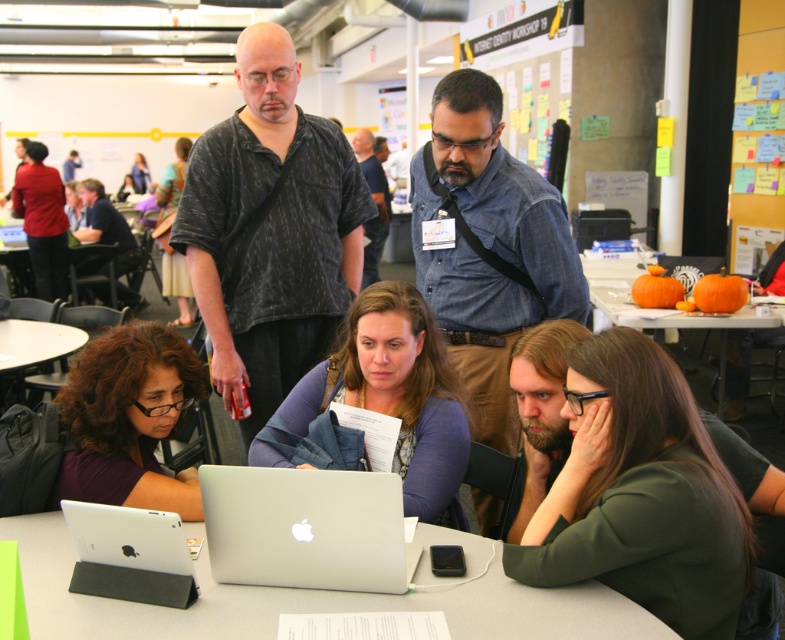
Question: Can you confirm if black textured shirt at upper center is positioned above white paperboard at upper center?

Choices:
 (A) no
 (B) yes

Answer: (A)

Question: Does silver metallic laptop at center have a smaller size compared to white paperboard at upper center?

Choices:
 (A) yes
 (B) no

Answer: (A)

Question: Which point is closer to the camera taking this photo?

Choices:
 (A) (473, 337)
 (B) (740, 218)

Answer: (A)

Question: Estimate the real-world distances between objects in this image. Which object is closer to the white paperboard at upper center?

Choices:
 (A) black textured shirt at upper center
 (B) white plastic table at lower center
 (C) white plastic table at lower left
 (D) white matte tablet at lower left

Answer: (A)

Question: Which point is farther from the camera taking this photo?

Choices:
 (A) (619, 320)
 (B) (367, 129)

Answer: (B)

Question: Is silver metallic laptop at center positioned in front of dark blue shirt at center?

Choices:
 (A) no
 (B) yes

Answer: (B)